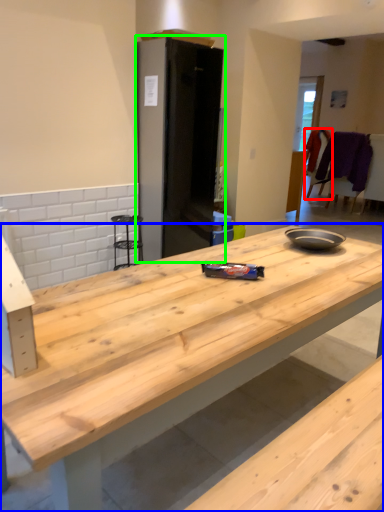
Question: Considering the real-world distances, which object is closest to chair (highlighted by a red box)? countertop (highlighted by a blue box) or appliance (highlighted by a green box).

Choices:
 (A) countertop
 (B) appliance

Answer: (B)